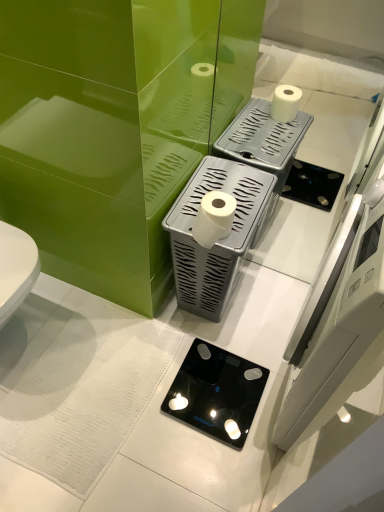
The image size is (384, 512). Identify the location of vacant area that lies between black glass scale at center, the second appliance when ordered from top to bottom, and white plastic toilet paper holder at center, the first appliance viewed from the top. (225, 334).